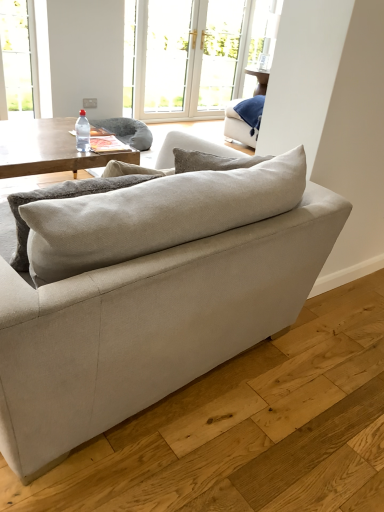
Image resolution: width=384 pixels, height=512 pixels. I want to click on clear glass screen door at upper center, so click(x=221, y=52).

Describe the element at coordinates (49, 149) in the screenshot. I see `woodenwoodencoffee table at left` at that location.

This screenshot has height=512, width=384. What do you see at coordinates (82, 132) in the screenshot?
I see `transparent plastic bottle at center` at bounding box center [82, 132].

Measure the distance between point (x=188, y=106) and camera.

Point (x=188, y=106) and camera are 18.81 feet apart.

This screenshot has width=384, height=512. What do you see at coordinates (167, 55) in the screenshot?
I see `white glossy window at upper center` at bounding box center [167, 55].

This screenshot has width=384, height=512. Find the location of `clear glass screen door at upper center`. clear glass screen door at upper center is located at coordinates (221, 52).

From a real-world perspective, is white glossy window at upper center on top of clear glass screen door at upper center?

No, from a real-world perspective, white glossy window at upper center is not over clear glass screen door at upper center

Is the position of white glossy window at upper center less distant than that of clear glass screen door at upper center?

Yes, white glossy window at upper center is in front of clear glass screen door at upper center.

Consider the image. Which is more distant, (179, 80) or (223, 17)?

The point (179, 80) is farther from the camera.

Can you confirm if white glossy window at upper center is bigger than clear glass screen door at upper center?

No, white glossy window at upper center is not bigger than clear glass screen door at upper center.

Looking at this image, from the image's perspective, is white glass door at upper center located beneath transparent plastic bottle at center?

No.

Which is more to the right, white glass door at upper center or transparent plastic bottle at center?

white glass door at upper center.

Which of these two, white glass door at upper center or transparent plastic bottle at center, stands taller?

Standing taller between the two is white glass door at upper center.

From a real-world perspective, is white glass door at upper center located higher than transparent plastic bottle at center?

Yes, from a real-world perspective, white glass door at upper center is above transparent plastic bottle at center.

Is woodenwoodencoffee table at left to the right of beige fabric couch at center from the viewer's perspective?

No.

Is point (46, 122) closer or farther from the camera than point (10, 377)?

Clearly, point (46, 122) is more distant from the camera than point (10, 377).

Which is in front, woodenwoodencoffee table at left or beige fabric couch at center?

beige fabric couch at center is closer to the camera.

Can you confirm if woodenwoodencoffee table at left is shorter than beige fabric couch at center?

Correct, woodenwoodencoffee table at left is not as tall as beige fabric couch at center.

Is clear glass screen door at upper center bigger or smaller than white glossy window at upper center?

clear glass screen door at upper center is bigger than white glossy window at upper center.

Would you say clear glass screen door at upper center contains white glossy window at upper center?

No, white glossy window at upper center is not a part of clear glass screen door at upper center.

Is clear glass screen door at upper center looking in the opposite direction of white glossy window at upper center?

No, clear glass screen door at upper center is not facing away from white glossy window at upper center.

From a real-world perspective, is white glossy window at upper center physically located above or below transparent plastic bottle at center?

In terms of real-world spatial position, white glossy window at upper center is above transparent plastic bottle at center.

Are white glossy window at upper center and transparent plastic bottle at center located far from each other?

Yes, white glossy window at upper center and transparent plastic bottle at center are located far from each other.

Which is in front, point (166, 76) or point (84, 142)?

The point (84, 142) is more forward.

From the image's perspective, does beige fabric couch at center appear lower than clear glass screen door at upper center?

Yes, from the image's perspective, beige fabric couch at center is below clear glass screen door at upper center.

In the scene shown: Do you think beige fabric couch at center is within clear glass screen door at upper center, or outside of it?

beige fabric couch at center is not enclosed by clear glass screen door at upper center.

Is beige fabric couch at center at the left side of clear glass screen door at upper center?

Indeed, beige fabric couch at center is positioned on the left side of clear glass screen door at upper center.

From a real-world perspective, is beige fabric couch at center over clear glass screen door at upper center?

No.

Is beige fabric couch at center further to camera compared to white glass door at upper center?

No, it is in front of white glass door at upper center.

Is point (305, 263) farther from camera compared to point (145, 87)?

That is False.

Which object is thinner, beige fabric couch at center or white glass door at upper center?

white glass door at upper center.

You are a GUI agent. You are given a task and a screenshot of the screen. Output one action in this format:
    pyautogui.click(x=<x>, y=<y>)
    Task: Click on the window in front of the clear glass screen door at upper center
    
    Given the screenshot: What is the action you would take?
    pyautogui.click(x=167, y=55)

Locate an element on the screen. This screenshot has height=512, width=384. window screen located above the transparent plastic bottle at center (from the image's perspective) is located at coordinates (193, 54).

From the image, which object appears to be nearer to beige fabric couch at center, white glass door at upper center or clear glass screen door at upper center?

white glass door at upper center is positioned closer to the anchor beige fabric couch at center.

Looking at the image, which one is located closer to white glossy window at upper center, white glass door at upper center or beige fabric couch at center?

The object closer to white glossy window at upper center is white glass door at upper center.

Considering their positions, is white glossy window at upper center positioned closer to beige fabric couch at center than woodenwoodencoffee table at left?

The object closer to beige fabric couch at center is woodenwoodencoffee table at left.

Considering their positions, is clear glass screen door at upper center positioned further to transparent plastic bottle at center than beige fabric couch at center?

clear glass screen door at upper center lies further to transparent plastic bottle at center than the other object.

Based on their spatial positions, is transparent plastic bottle at center or woodenwoodencoffee table at left closer to white glass door at upper center?

Among the two, woodenwoodencoffee table at left is located nearer to white glass door at upper center.

When comparing their distances from woodenwoodencoffee table at left, does clear glass screen door at upper center or white glass door at upper center seem further?

The object further to woodenwoodencoffee table at left is clear glass screen door at upper center.

When comparing their distances from white glossy window at upper center, does beige fabric couch at center or clear glass screen door at upper center seem further?

beige fabric couch at center is further to white glossy window at upper center.

Estimate the real-world distances between objects in this image. Which object is further from transparent plastic bottle at center, white glass door at upper center or white glossy window at upper center?

white glossy window at upper center is further to transparent plastic bottle at center.

Image resolution: width=384 pixels, height=512 pixels. Identify the location of window between beige fabric couch at center and clear glass screen door at upper center from front to back. (167, 55).

Locate an element on the screen. bottle between woodenwoodencoffee table at left and clear glass screen door at upper center from front to back is located at coordinates (82, 132).

At what (x,y) coordinates should I click in order to perform the action: click on window screen between beige fabric couch at center and clear glass screen door at upper center along the z-axis. Please return your answer as a coordinate pair (x, y). Looking at the image, I should click on (x=193, y=54).

Find the location of a particular element. This screenshot has height=512, width=384. window between woodenwoodencoffee table at left and white glass door at upper center from front to back is located at coordinates (167, 55).